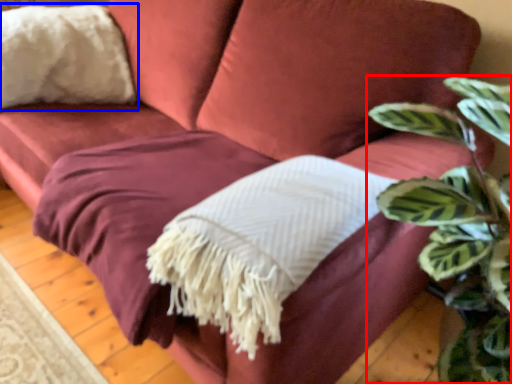
Question: Which point is further to the camera, houseplant (highlighted by a red box) or throw pillow (highlighted by a blue box)?

Choices:
 (A) houseplant
 (B) throw pillow

Answer: (B)